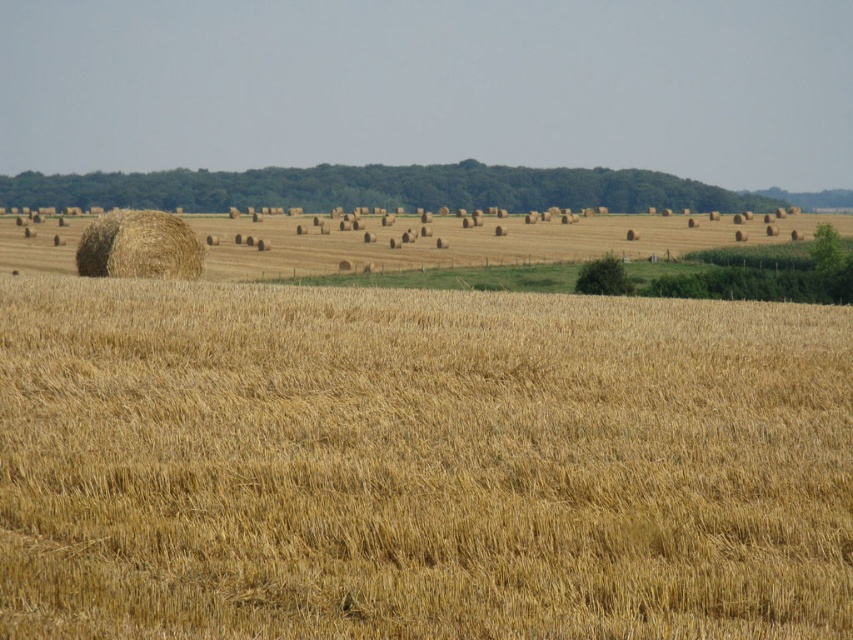
You are a farmer who needs to move a 1.2 meter wide tractor from the dry straw at center to the golden straw bale at left. Is the path between them wide enough for the tractor to pass through?

The distance between the dry straw at center and the golden straw bale at left is 58.19 meters, which is more than enough for a 1.2 meter wide tractor to pass through safely.

You are a farmer checking the field. You see two golden straw bales in the field. One is labeled as the golden straw bale at left and the other as the golden straw bale at center. From your position, which golden straw bale is actually located to the left?

The golden straw bale at center is actually located to the left because the golden straw bale at left is positioned to its right.

You are a farmer who needs to transport the dry straw at center and the golden straw bale at center to the storage barn. Which object requires a larger vehicle to carry due to its size?

The dry straw at center requires a larger vehicle because it is larger in size than the golden straw bale at center.